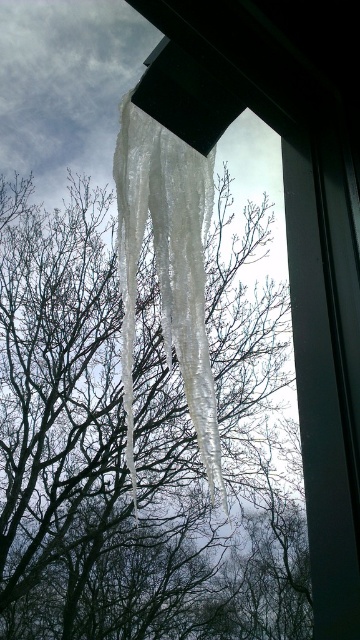
Question: Is transparent ice icicles at center to the right of clear ice icicles at center from the viewer's perspective?

Choices:
 (A) no
 (B) yes

Answer: (A)

Question: From the image, what is the correct spatial relationship of transparent ice icicles at center in relation to clear ice icicles at center?

Choices:
 (A) right
 (B) left

Answer: (B)

Question: Can you confirm if transparent ice icicles at center is positioned above clear ice icicles at center?

Choices:
 (A) yes
 (B) no

Answer: (B)

Question: Which of the following is the closest to the observer?

Choices:
 (A) (174, 326)
 (B) (33, 477)

Answer: (A)